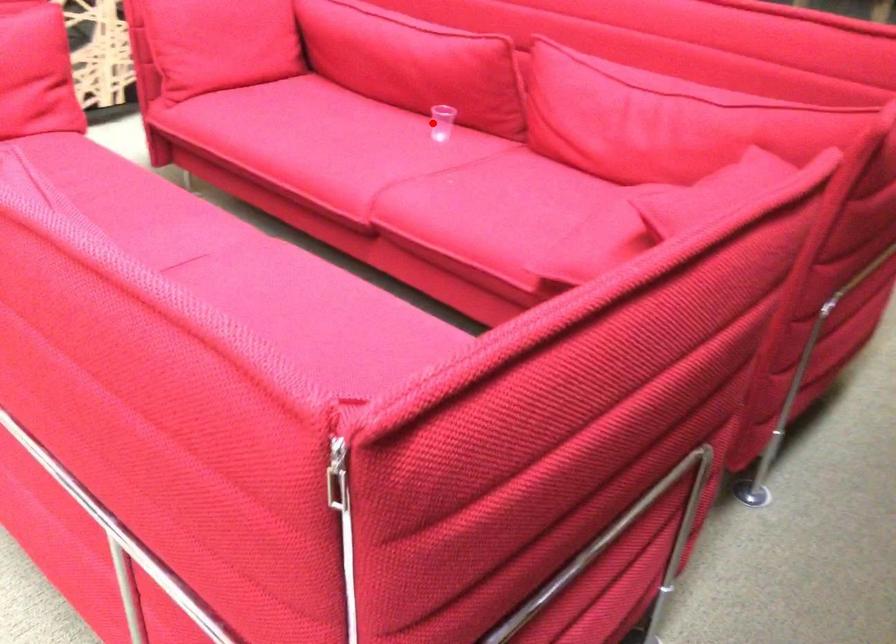
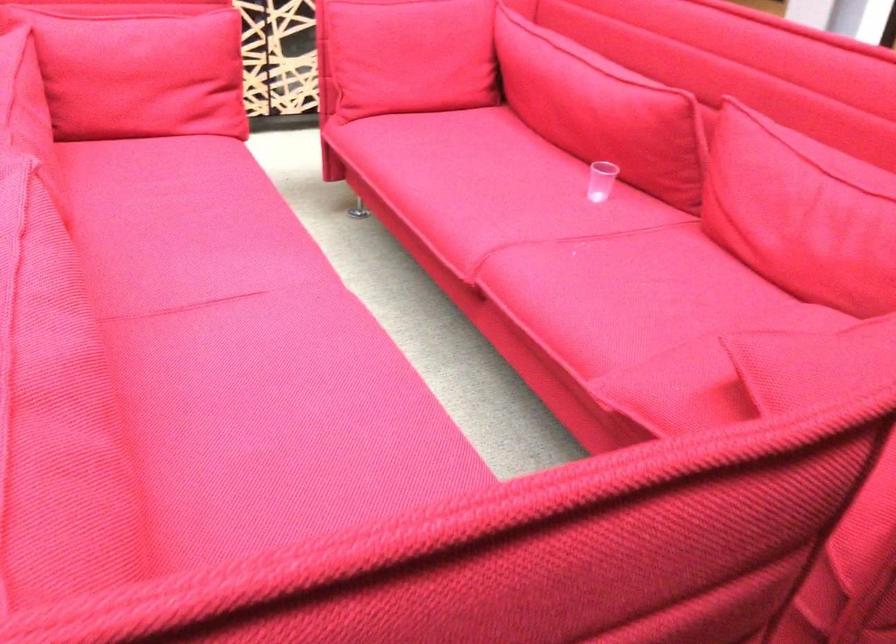
Locate, in the second image, the point that corresponds to the highlighted location in the first image.

(600, 180)